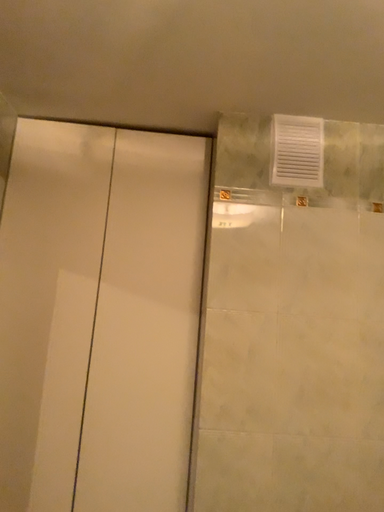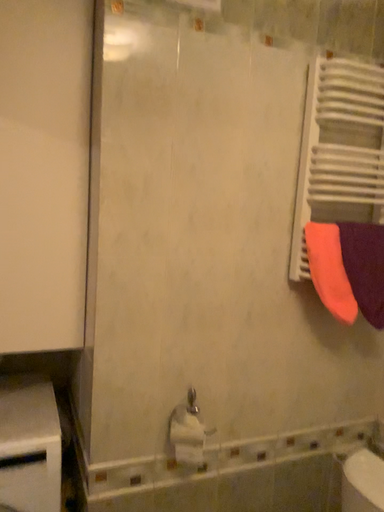
Question: Which way did the camera rotate in the video?

Choices:
 (A) rotated right
 (B) rotated left

Answer: (A)